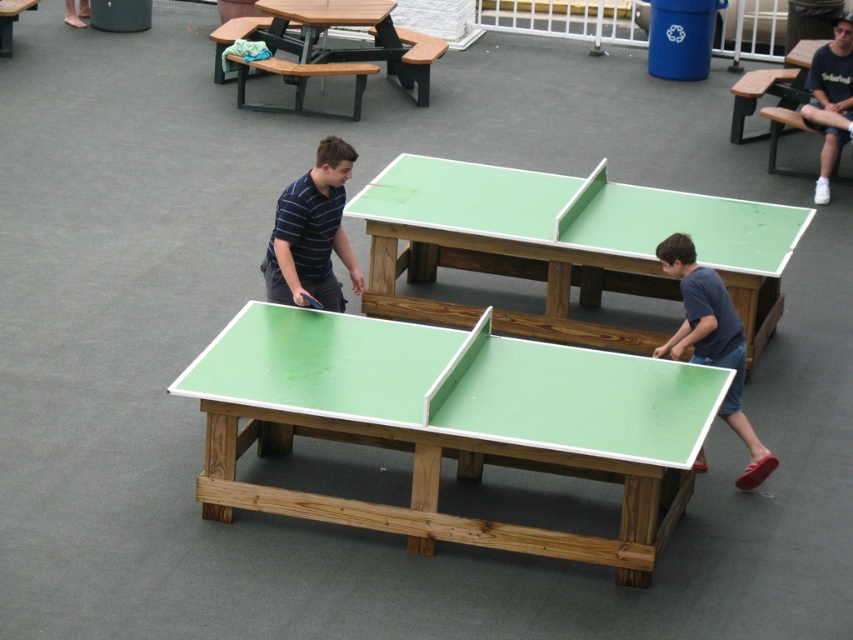
Measure the distance between green wooden ping pong table at center and rubber green table tennis at lower right.

A distance of 2.40 meters exists between green wooden ping pong table at center and rubber green table tennis at lower right.

Between green wooden ping pong table at center and rubber green table tennis at lower right, which one appears on the left side from the viewer's perspective?

Positioned to the left is green wooden ping pong table at center.

I want to click on green wooden ping pong table at center, so click(564, 244).

Measure the distance between point (679,337) and camera.

Point (679,337) is 8.48 meters from camera.

Is blue fabric shirt at lower right behind rubber green table tennis at lower right?

No, blue fabric shirt at lower right is in front of rubber green table tennis at lower right.

Describe the element at coordinates (712, 342) in the screenshot. This screenshot has width=853, height=640. I see `blue fabric shirt at lower right` at that location.

At what (x,y) coordinates should I click in order to perform the action: click on blue fabric shirt at lower right. Please return your answer as a coordinate pair (x, y). This screenshot has width=853, height=640. Looking at the image, I should click on (712, 342).

Which is above, green wooden ping pong table at center or green wooden table tennis table at center?

green wooden ping pong table at center is higher up.

Between green wooden ping pong table at center and green wooden table tennis table at center, which one has more height?

green wooden ping pong table at center

This screenshot has width=853, height=640. I want to click on green wooden ping pong table at center, so click(564, 244).

Find the location of a particular element. Image resolution: width=853 pixels, height=640 pixels. green wooden ping pong table at center is located at coordinates (564, 244).